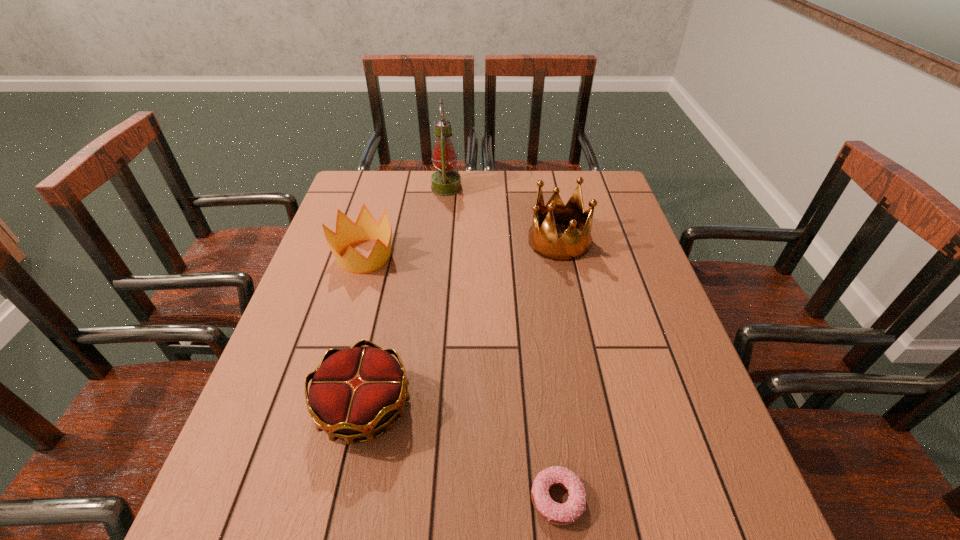
Identify the location of the farthest object. The width and height of the screenshot is (960, 540). (445, 182).

Identify the location of oil lamp. The height and width of the screenshot is (540, 960). (445, 182).

The width and height of the screenshot is (960, 540). I want to click on the fourth shortest object, so click(x=544, y=241).

The width and height of the screenshot is (960, 540). I want to click on the rightmost crown, so click(x=544, y=241).

Locate an element on the screen. the fourth farthest object is located at coordinates (355, 392).

This screenshot has height=540, width=960. I want to click on the nearest object, so click(566, 513).

Find the location of a particular element. The height and width of the screenshot is (540, 960). the shortest object is located at coordinates (566, 513).

The height and width of the screenshot is (540, 960). I want to click on blank space located 0.220m on the front of the tallest object, so click(x=441, y=241).

Locate an element on the screen. vacant point located 0.340m on the front of the tallest crown is located at coordinates (585, 363).

Identify the location of blank space located on the back of the fourth farthest object. This screenshot has width=960, height=540. (381, 326).